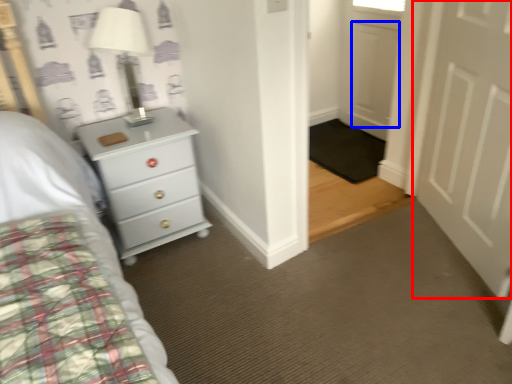
Question: Which object appears closest to the camera in this image, door (highlighted by a red box) or door (highlighted by a blue box)?

Choices:
 (A) door
 (B) door

Answer: (A)